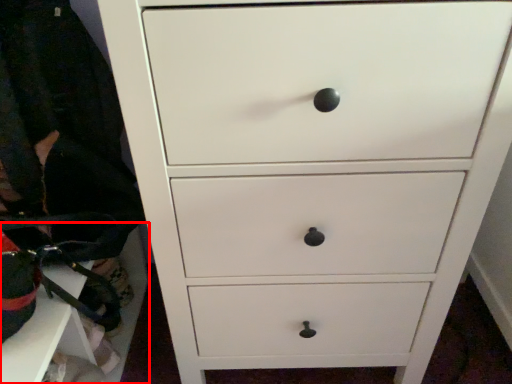
Question: Observing the image, what is the correct spatial positioning of cabinetry (annotated by the red box) in reference to clothing?

Choices:
 (A) left
 (B) right

Answer: (A)